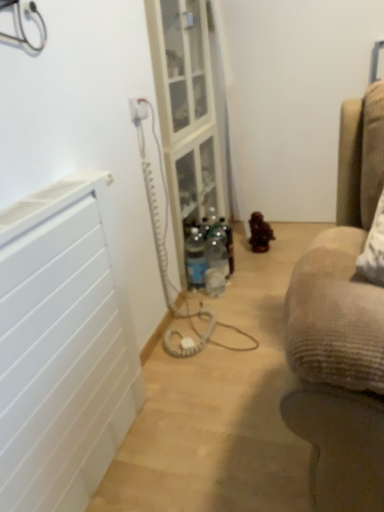
Find the location of a particular element. Image resolution: width=384 pixels, height=512 pixels. free spot above white matte radiator at left (from a real-world perspective) is located at coordinates (50, 193).